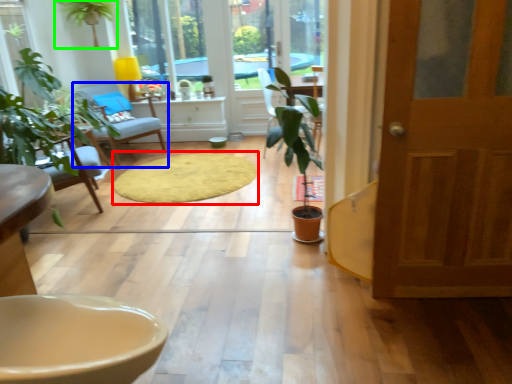
Question: Estimate the real-world distances between objects in this image. Which object is closer to mat (highlighted by a red box), chair (highlighted by a blue box) or houseplant (highlighted by a green box)?

Choices:
 (A) chair
 (B) houseplant

Answer: (A)